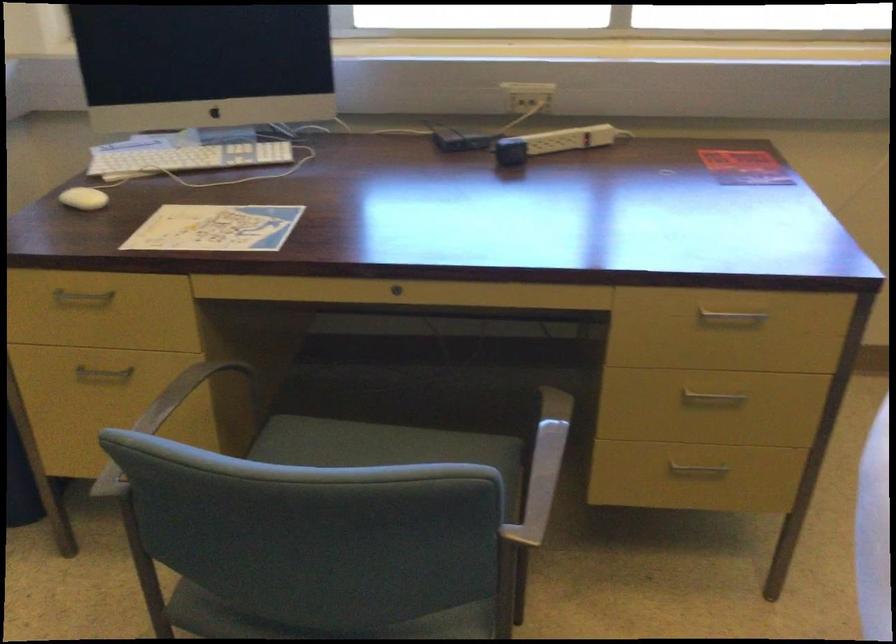
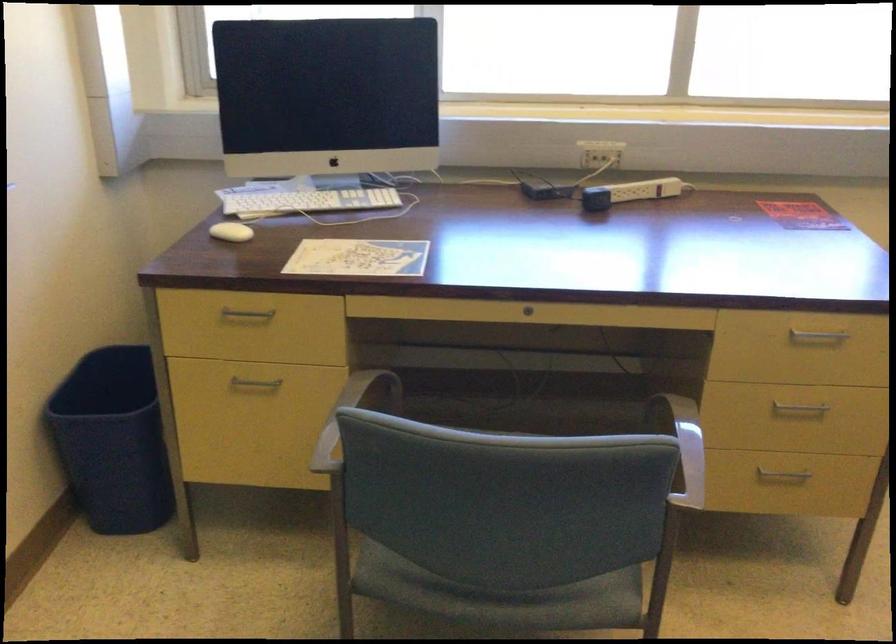
Where in the second image is the point corresponding to (x=183, y=158) from the first image?

(304, 200)